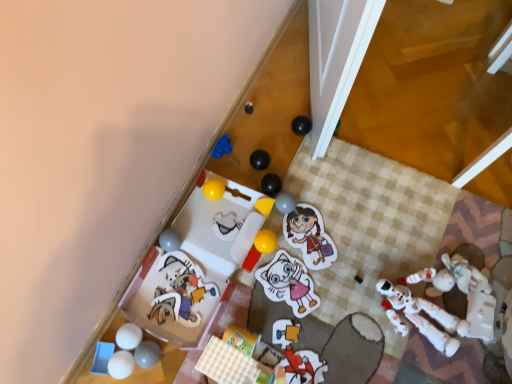
The width and height of the screenshot is (512, 384). I want to click on vacant space in between matte gray ball at lower left, which is counted as the twelfth toy, starting from the right, and rubber matte ball at center, which ranks as the thirteenth toy in left-to-right order, so click(x=217, y=281).